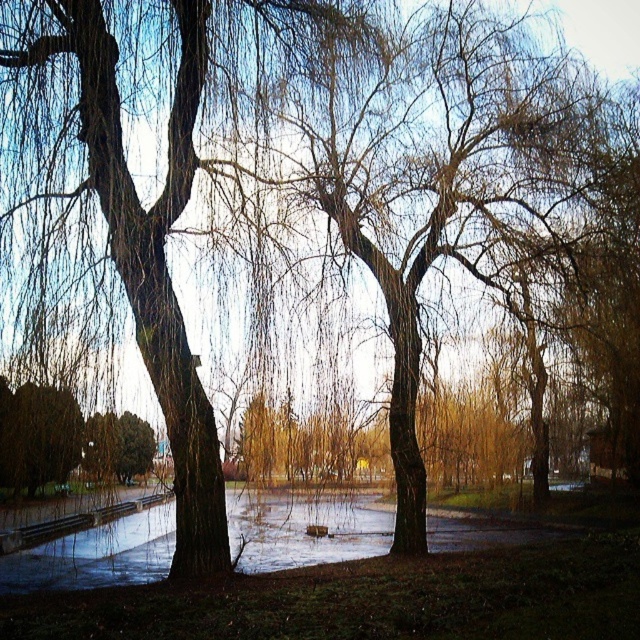
Which is in front, point (429, 16) or point (45, 410)?

Point (45, 410)

Is brown textured tree at left above green matte bush at lower left?

Correct, brown textured tree at left is located above green matte bush at lower left.

Between point (499, 291) and point (4, 486), which one is positioned in front?

Positioned in front is point (4, 486).

Locate an element on the screen. The image size is (640, 640). brown textured tree at left is located at coordinates (442, 182).

Identify the location of brown textured tree at left. (442, 182).

Identify the location of brown textured tree at left. This screenshot has width=640, height=640. (442, 182).

Can you confirm if smooth bark tree at center is positioned to the left of green matte bush at lower left?

In fact, smooth bark tree at center is to the right of green matte bush at lower left.

Can you confirm if smooth bark tree at center is thinner than green matte bush at lower left?

Correct, smooth bark tree at center's width is less than green matte bush at lower left's.

Does point (90, 28) come in front of point (65, 451)?

Yes, point (90, 28) is closer to viewer.

Locate an element on the screen. The image size is (640, 640). smooth bark tree at center is located at coordinates (150, 252).